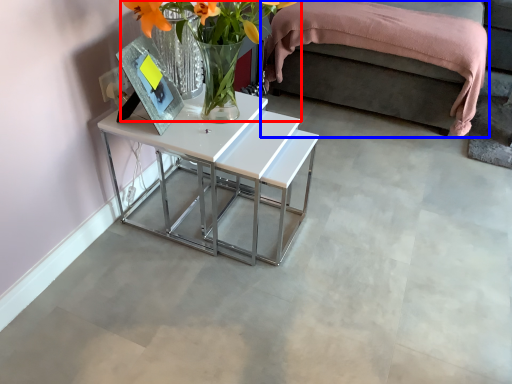
Question: Which object is further to the camera taking this photo, floral arrangement (highlighted by a red box) or bed (highlighted by a blue box)?

Choices:
 (A) floral arrangement
 (B) bed

Answer: (B)